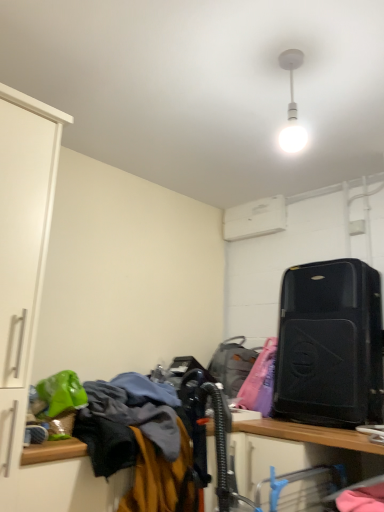
Question: Is white plastic air conditioner at upper center oriented away from black matte suitcase at right?

Choices:
 (A) no
 (B) yes

Answer: (A)

Question: From a real-world perspective, is white plastic air conditioner at upper center physically below black matte suitcase at right?

Choices:
 (A) no
 (B) yes

Answer: (A)

Question: Does white plastic air conditioner at upper center have a smaller size compared to black matte suitcase at right?

Choices:
 (A) no
 (B) yes

Answer: (B)

Question: Does white plastic air conditioner at upper center contain black matte suitcase at right?

Choices:
 (A) yes
 (B) no

Answer: (B)

Question: Is white plastic air conditioner at upper center far away from black matte suitcase at right?

Choices:
 (A) yes
 (B) no

Answer: (B)

Question: Is metallic silver computer desk at lower center in front of or behind black matte suitcase at right in the image?

Choices:
 (A) front
 (B) behind

Answer: (A)

Question: From their relative heights in the image, would you say metallic silver computer desk at lower center is taller or shorter than black matte suitcase at right?

Choices:
 (A) tall
 (B) short

Answer: (B)

Question: From a real-world perspective, is metallic silver computer desk at lower center above or below black matte suitcase at right?

Choices:
 (A) below
 (B) above

Answer: (A)

Question: Is metallic silver computer desk at lower center wider or thinner than black matte suitcase at right?

Choices:
 (A) wide
 (B) thin

Answer: (A)

Question: Based on their positions, is textured fabric laundry at lower left located to the left or right of black matte suitcase at right?

Choices:
 (A) left
 (B) right

Answer: (A)

Question: In terms of size, does textured fabric laundry at lower left appear bigger or smaller than black matte suitcase at right?

Choices:
 (A) big
 (B) small

Answer: (A)

Question: Would you say textured fabric laundry at lower left is inside or outside black matte suitcase at right?

Choices:
 (A) inside
 (B) outside

Answer: (B)

Question: Is textured fabric laundry at lower left wider or thinner than black matte suitcase at right?

Choices:
 (A) thin
 (B) wide

Answer: (B)

Question: Looking at their shapes, would you say matte black suitcase at center right is wider or thinner than black matte suitcase at right?

Choices:
 (A) thin
 (B) wide

Answer: (A)

Question: From a real-world perspective, relative to black matte suitcase at right, is matte black suitcase at center right vertically above or below?

Choices:
 (A) below
 (B) above

Answer: (A)